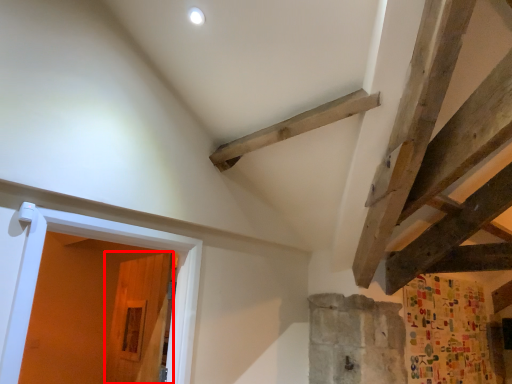
Question: Observing the image, what is the correct spatial positioning of door (annotated by the red box) in reference to door?

Choices:
 (A) left
 (B) right

Answer: (A)